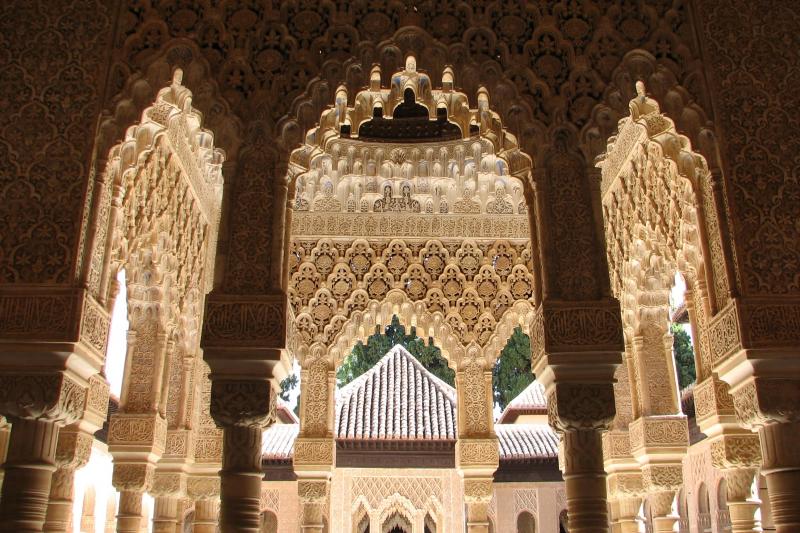
Where is `grey paneling`? grey paneling is located at coordinates (530, 474).